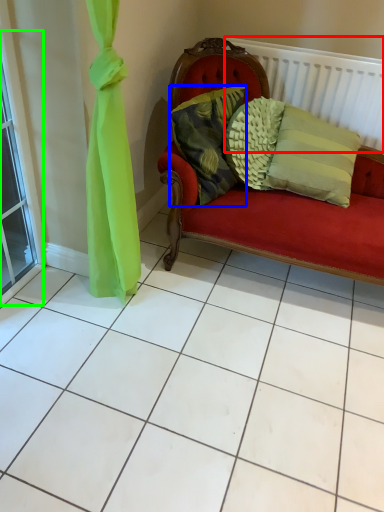
Question: Which object is the closest to the balustrade (highlighted by a red box)? Choose among these: pillow (highlighted by a blue box) or window (highlighted by a green box).

Choices:
 (A) pillow
 (B) window

Answer: (A)